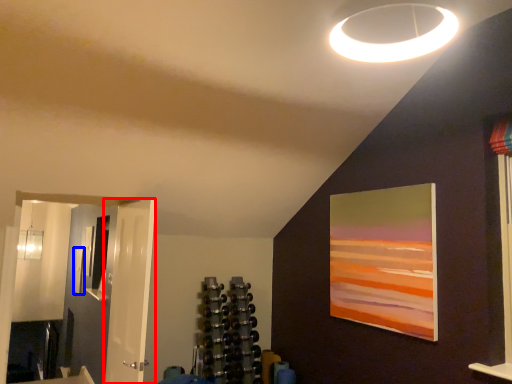
Question: Which object appears closest to the camera in this image, door (highlighted by a red box) or picture frame (highlighted by a blue box)?

Choices:
 (A) door
 (B) picture frame

Answer: (A)